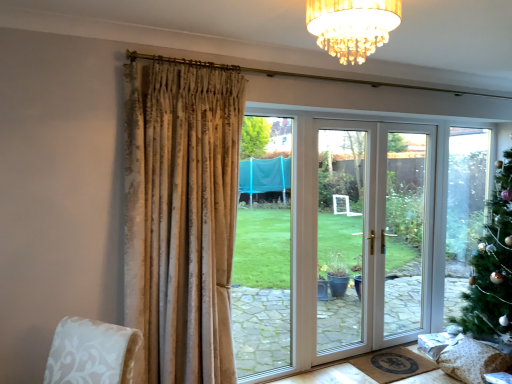
What do you see at coordinates (352, 26) in the screenshot? Image resolution: width=512 pixels, height=384 pixels. I see `crystal chandelier at upper center` at bounding box center [352, 26].

In order to click on crystal chandelier at upper center in this screenshot , I will do `click(352, 26)`.

In order to face crystal chandelier at upper center, should I rotate leftwards or rightwards?

Rotate your view right by about 12.215°.

In order to click on crystal chandelier at upper center in this screenshot , I will do `click(352, 26)`.